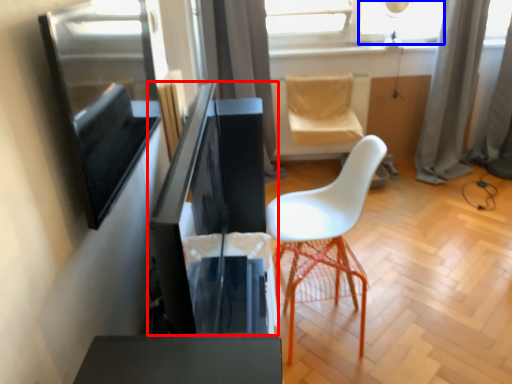
Question: Which point is closer to the camera, computer desk (highlighted by a red box) or window (highlighted by a blue box)?

Choices:
 (A) computer desk
 (B) window

Answer: (A)